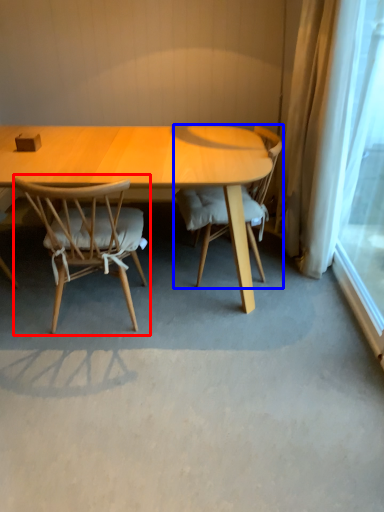
Question: Which point is further to the camera, chair (highlighted by a red box) or chair (highlighted by a blue box)?

Choices:
 (A) chair
 (B) chair

Answer: (B)